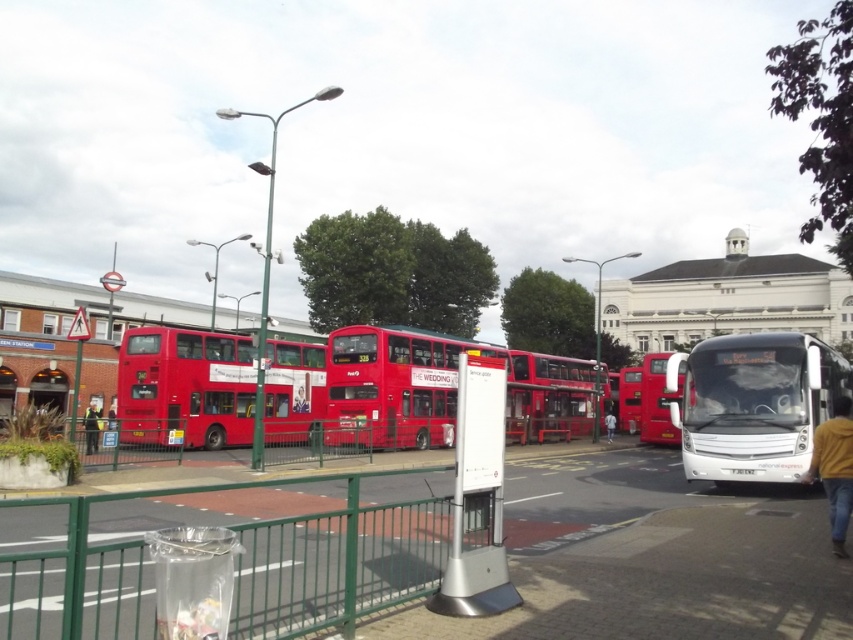
Does white glossy coach at center have a lesser width compared to matte red bus at center?

Correct, white glossy coach at center's width is less than matte red bus at center's.

You are a GUI agent. You are given a task and a screenshot of the screen. Output one action in this format:
    pyautogui.click(x=<x>, y=<y>)
    Task: Click on the white glossy coach at center
    The height and width of the screenshot is (640, 853).
    Given the screenshot: What is the action you would take?
    pyautogui.click(x=753, y=403)

This screenshot has height=640, width=853. Describe the element at coordinates (753, 403) in the screenshot. I see `white glossy coach at center` at that location.

Locate an element on the screen. Image resolution: width=853 pixels, height=640 pixels. white glossy coach at center is located at coordinates (753, 403).

Does matte red double-decker bus at center have a lesser height compared to matte red bus at center?

Indeed, matte red double-decker bus at center has a lesser height compared to matte red bus at center.

Is the position of matte red double-decker bus at center more distant than that of matte red bus at center?

Yes, matte red double-decker bus at center is behind matte red bus at center.

Does point (213, 404) come closer to viewer compared to point (666, 397)?

Yes, point (213, 404) is closer to viewer.

I want to click on matte red double-decker bus at center, so click(186, 387).

Which is below, white glossy coach at center or matte red double-decker bus at center?

matte red double-decker bus at center

Can you confirm if white glossy coach at center is positioned below matte red double-decker bus at center?

Actually, white glossy coach at center is above matte red double-decker bus at center.

Is point (703, 476) farther from viewer compared to point (316, 355)?

No, (703, 476) is closer to viewer.

Identify the location of white glossy coach at center. The width and height of the screenshot is (853, 640). (753, 403).